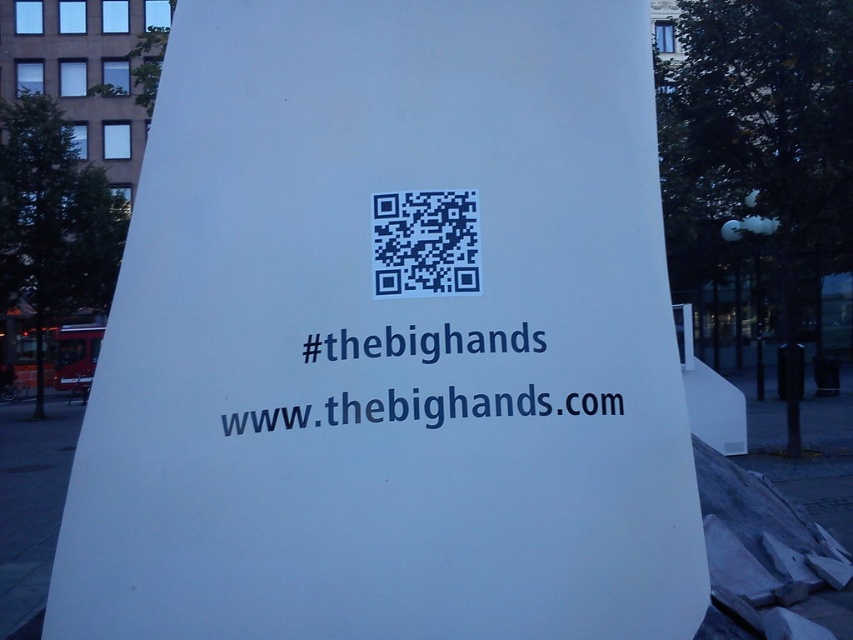
Between blue text at center and dark blue qr code at center, which one is positioned lower?

Positioned lower is blue text at center.

Find the location of a particular element. The height and width of the screenshot is (640, 853). blue text at center is located at coordinates (462, 404).

The height and width of the screenshot is (640, 853). I want to click on blue text at center, so pos(462,404).